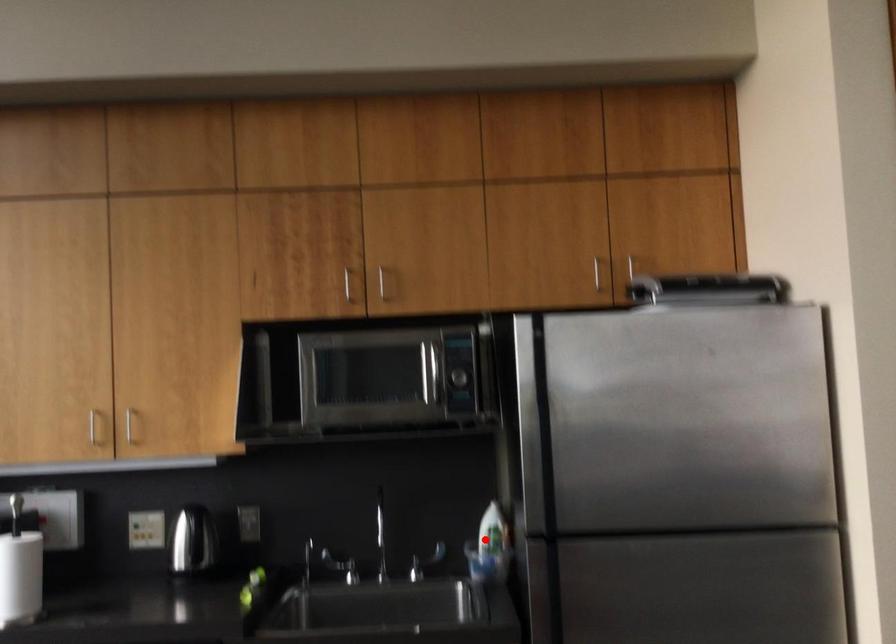
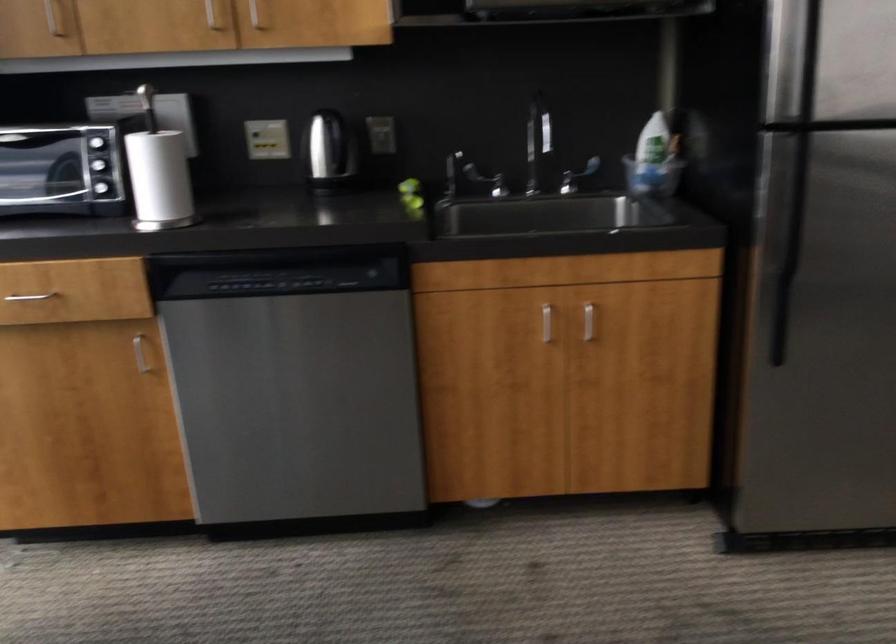
Question: I am providing you with two images of the same scene from different viewpoints. Given a red point in image1, look at the same physical point in image2. Is it:

Choices:
 (A) Closer to the viewpoint
 (B) Farther from the viewpoint

Answer: (A)